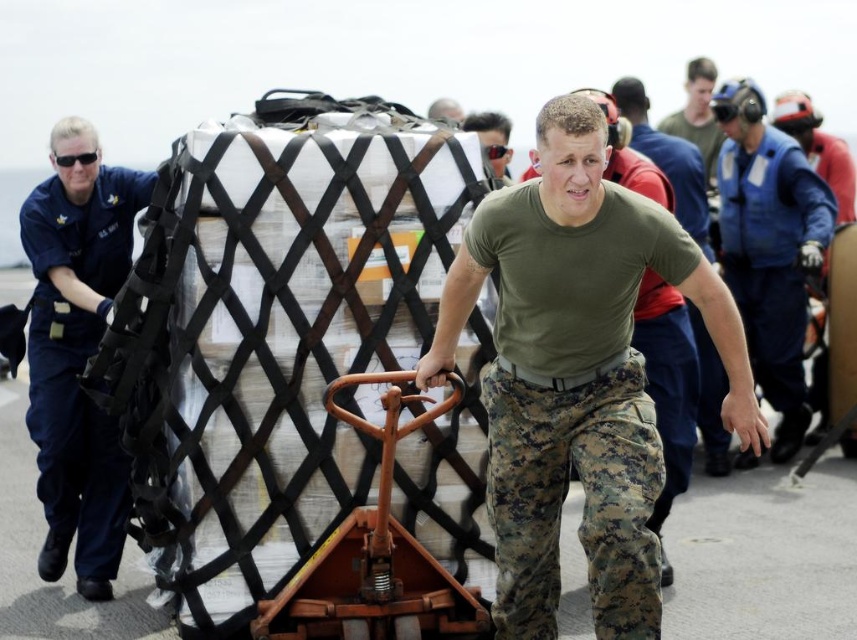
Is the position of blue uniform at center less distant than that of matte black sunglasses at center?

No, it is behind matte black sunglasses at center.

Between blue uniform at center and matte black sunglasses at center, which one appears on the right side from the viewer's perspective?

blue uniform at center

Who is more distant from viewer, (844, 208) or (502, 140)?

The point (844, 208) is more distant.

You are a GUI agent. You are given a task and a screenshot of the screen. Output one action in this format:
    pyautogui.click(x=<x>, y=<y>)
    Task: Click on the blue uniform at center
    The width and height of the screenshot is (857, 640).
    Given the screenshot: What is the action you would take?
    pyautogui.click(x=818, y=148)

Is the position of green camo pants at center less distant than that of blue uniform at left?

Yes, it is.

From the picture: Who is lower down, green camo pants at center or blue uniform at left?

blue uniform at left is lower down.

In order to click on green camo pants at center in this screenshot , I will do `click(577, 374)`.

Between green camo pants at center and blue uniform at center, which one appears on the right side from the viewer's perspective?

blue uniform at center is more to the right.

Is green camo pants at center positioned at the back of blue uniform at center?

No, green camo pants at center is in front of blue uniform at center.

In order to click on green camo pants at center in this screenshot , I will do `click(577, 374)`.